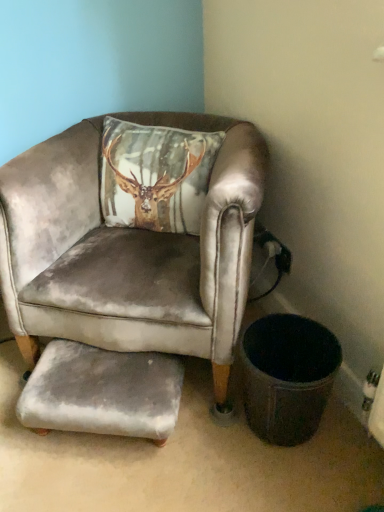
Measure the distance between velvet gray armchair at center and camera.

velvet gray armchair at center and camera are 35.83 inches apart.

The width and height of the screenshot is (384, 512). What do you see at coordinates (128, 251) in the screenshot? I see `velvet gray armchair at center` at bounding box center [128, 251].

You are a GUI agent. You are given a task and a screenshot of the screen. Output one action in this format:
    pyautogui.click(x=<x>, y=<y>)
    Task: Click on the velvet gray armchair at center
    
    Given the screenshot: What is the action you would take?
    pyautogui.click(x=128, y=251)

This screenshot has width=384, height=512. Describe the element at coordinates (102, 392) in the screenshot. I see `gray velvety footrest at lower center` at that location.

Find the location of a particular element. This screenshot has width=384, height=512. gray velvety footrest at lower center is located at coordinates (102, 392).

Measure the distance between point (146, 376) and camera.

Point (146, 376) and camera are 3.51 feet apart.

Locate an element on the screen. velvet gray armchair at center is located at coordinates (128, 251).

Which object is positioned more to the left, gray velvety footrest at lower center or velvet gray armchair at center?

gray velvety footrest at lower center is more to the left.

Which object is closer to the camera, gray velvety footrest at lower center or velvet gray armchair at center?

velvet gray armchair at center is closer to the camera.

Which is nearer, [68,370] or [66,192]?

Point [68,370].

From the image's perspective, is gray velvety footrest at lower center located above or below velvet gray armchair at center?

Clearly, from the image's perspective, gray velvety footrest at lower center is below velvet gray armchair at center.

From a real-world perspective, who is located lower, gray velvety footrest at lower center or velvet gray armchair at center?

From a 3D spatial view, gray velvety footrest at lower center is below.

Is gray velvety footrest at lower center wider than velvet gray armchair at center?

No.

Which of these two, gray velvety footrest at lower center or velvet gray armchair at center, stands taller?

Standing taller between the two is velvet gray armchair at center.

Considering the sizes of objects gray velvety footrest at lower center and velvet gray armchair at center in the image provided, who is bigger, gray velvety footrest at lower center or velvet gray armchair at center?

velvet gray armchair at center is bigger.

Is gray velvety footrest at lower center completely or partially outside of velvet gray armchair at center?

Actually, gray velvety footrest at lower center is at least partially inside velvet gray armchair at center.

Is gray velvety footrest at lower center not near velvet gray armchair at center?

No, there isn't a large distance between gray velvety footrest at lower center and velvet gray armchair at center.

Could you tell me if gray velvety footrest at lower center is turned towards velvet gray armchair at center?

No, gray velvety footrest at lower center does not turn towards velvet gray armchair at center.

How different are the orientations of gray velvety footrest at lower center and velvet gray armchair at center in degrees?

gray velvety footrest at lower center and velvet gray armchair at center are facing 6.22 degrees away from each other.

I want to click on the footrest beneath the velvet gray armchair at center (from a real-world perspective), so click(x=102, y=392).

Is velvet gray armchair at center at the left side of gray velvety footrest at lower center?

No.

Considering the relative positions of velvet gray armchair at center and gray velvety footrest at lower center in the image provided, is velvet gray armchair at center behind gray velvety footrest at lower center?

No, velvet gray armchair at center is in front of gray velvety footrest at lower center.

Which is in front, point (9, 251) or point (26, 383)?

The point (26, 383) is in front.

From the image's perspective, which one is positioned lower, velvet gray armchair at center or gray velvety footrest at lower center?

gray velvety footrest at lower center, from the image's perspective.

From a real-world perspective, is velvet gray armchair at center over gray velvety footrest at lower center?

Correct, in the physical world, velvet gray armchair at center is higher than gray velvety footrest at lower center.

Which object is wider, velvet gray armchair at center or gray velvety footrest at lower center?

With larger width is velvet gray armchair at center.

Can you confirm if velvet gray armchair at center is taller than gray velvety footrest at lower center?

Yes, velvet gray armchair at center is taller than gray velvety footrest at lower center.

Is velvet gray armchair at center smaller than gray velvety footrest at lower center?

No, velvet gray armchair at center is not smaller than gray velvety footrest at lower center.

Do you think velvet gray armchair at center is within gray velvety footrest at lower center, or outside of it?

velvet gray armchair at center is spatially situated outside gray velvety footrest at lower center.

Consider the image. Can you see velvet gray armchair at center touching gray velvety footrest at lower center?

No, velvet gray armchair at center is not with gray velvety footrest at lower center.

Is velvet gray armchair at center aimed at gray velvety footrest at lower center?

Yes.

What's the angular difference between velvet gray armchair at center and gray velvety footrest at lower center's facing directions?

They differ by 6.22 degrees in their facing directions.

How far apart are velvet gray armchair at center and gray velvety footrest at lower center?

velvet gray armchair at center and gray velvety footrest at lower center are 23.00 centimeters apart from each other.

The image size is (384, 512). In order to click on the footrest behind the velvet gray armchair at center in this screenshot , I will do `click(102, 392)`.

The width and height of the screenshot is (384, 512). Identify the location of chair on the right of gray velvety footrest at lower center. (128, 251).

At what (x,y) coordinates should I click in order to perform the action: click on footrest below the velvet gray armchair at center (from a real-world perspective). Please return your answer as a coordinate pair (x, y). Looking at the image, I should click on (102, 392).